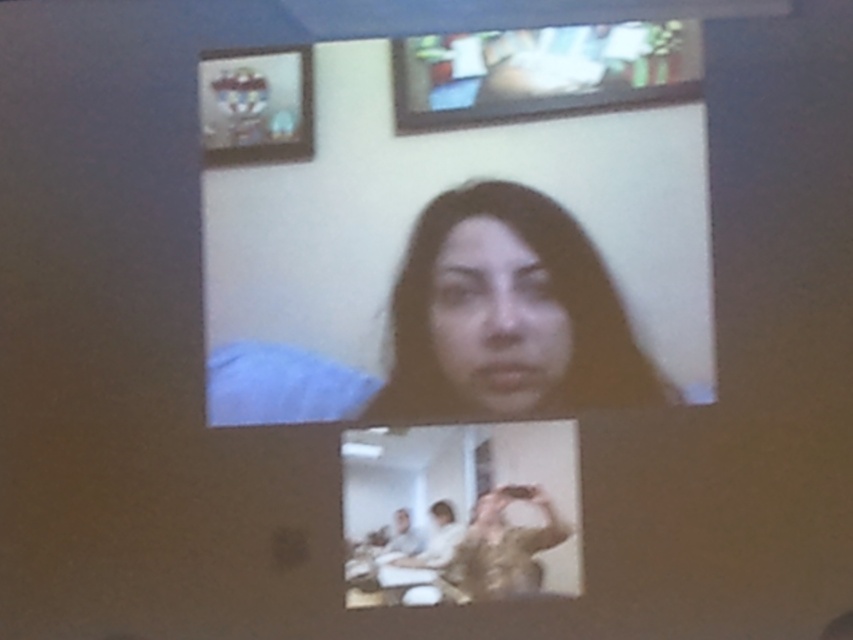
Question: Can you confirm if matte black screen at center is positioned to the right of smooth skin face at center?

Choices:
 (A) yes
 (B) no

Answer: (B)

Question: Does matte black screen at center have a larger size compared to smooth skin face at center?

Choices:
 (A) yes
 (B) no

Answer: (A)

Question: Among these objects, which one is farthest from the camera?

Choices:
 (A) dark matte hair at center
 (B) smooth skin face at center

Answer: (B)

Question: From the image, what is the correct spatial relationship of dark matte hair at center in relation to smooth skin face at center?

Choices:
 (A) above
 (B) below

Answer: (B)

Question: Which point is farther to the camera?

Choices:
 (A) dark matte hair at center
 (B) matte black screen at center
 (C) smooth skin face at center

Answer: (C)

Question: Which point is closer to the camera?

Choices:
 (A) (485, 330)
 (B) (531, 308)

Answer: (B)